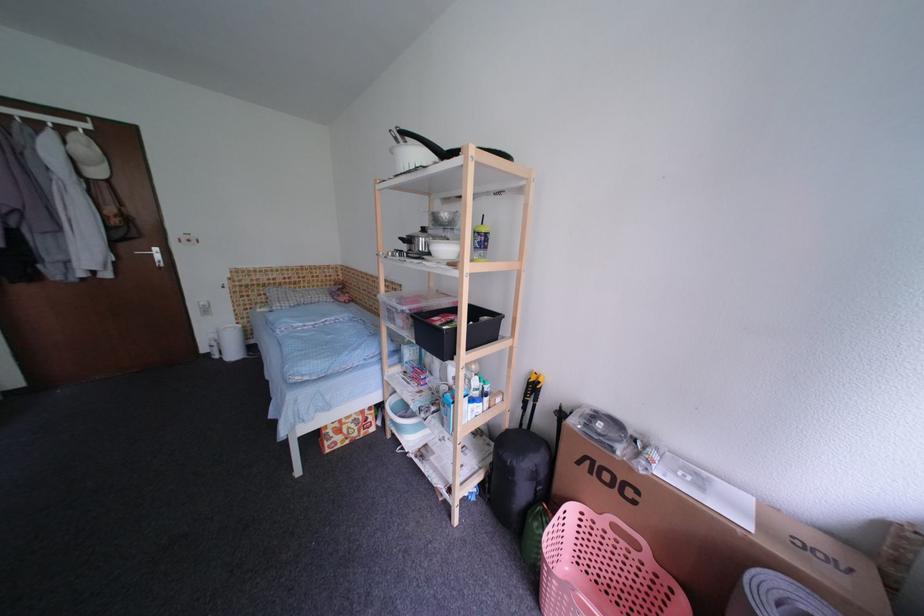
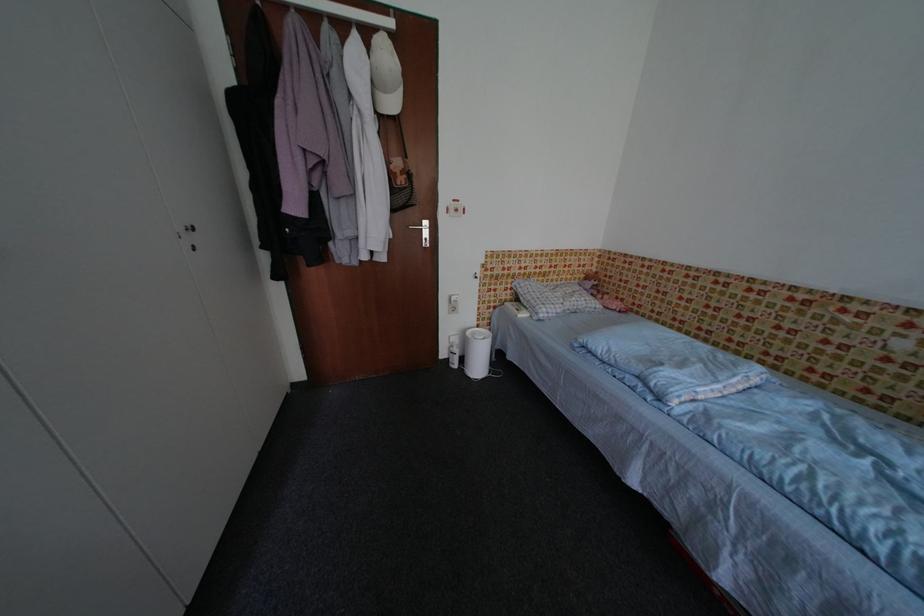
Locate, in the second image, the point that corresponds to point 216,357 in the first image.

(455, 363)